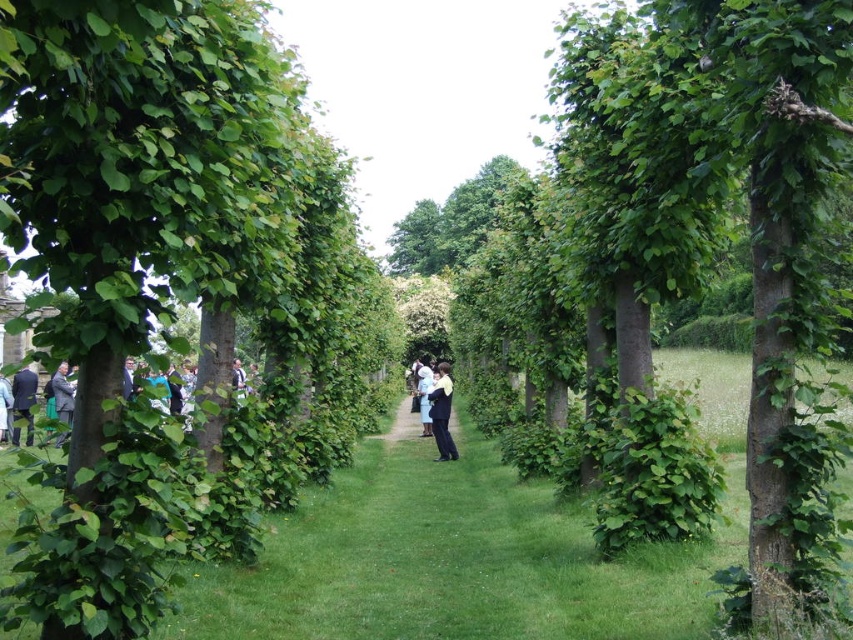
You are a photographer planning to take a photo of the group of people at the end of the garden pathway. You notice the green leafy tree at center and the white fabric at center in the scene. Which object should you avoid placing in front of the people to ensure they are clearly visible in your photo?

You should avoid placing the green leafy tree at center in front of the people because it is located above the white fabric at center, which could block the view of the people if positioned in front.